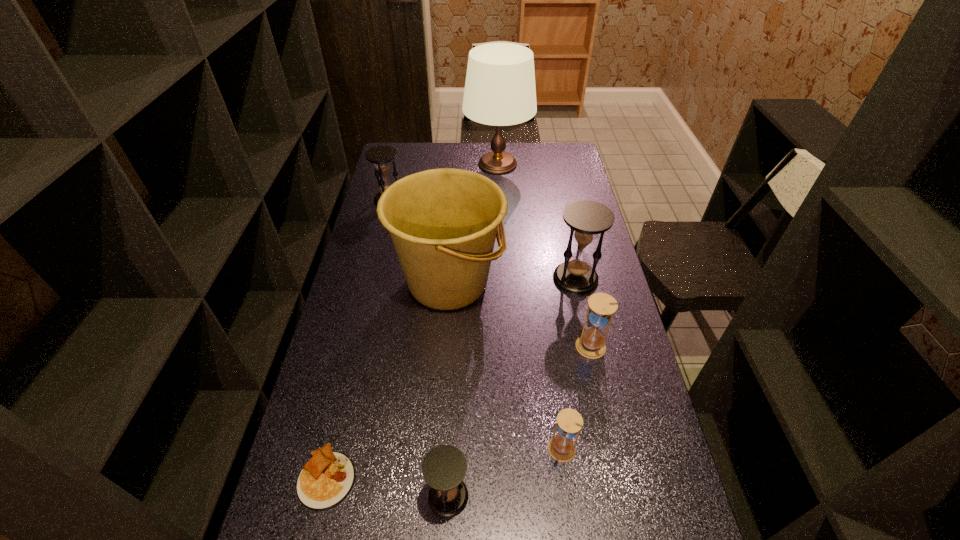
Where is `white lamp`? Image resolution: width=960 pixels, height=540 pixels. white lamp is located at coordinates (500, 90).

Where is `lamp`? The height and width of the screenshot is (540, 960). lamp is located at coordinates (500, 90).

Locate an element on the screen. The width and height of the screenshot is (960, 540). bucket is located at coordinates (443, 223).

The width and height of the screenshot is (960, 540). In order to click on the sixth shortest object in this screenshot , I will do `click(587, 219)`.

The image size is (960, 540). Identify the location of the biggest black hourglass. (587, 219).

Find the location of a particular element. The width and height of the screenshot is (960, 540). the leftmost hourglass is located at coordinates (381, 156).

This screenshot has height=540, width=960. What are the coordinates of `the second biggest black hourglass` in the screenshot? It's located at (381, 156).

This screenshot has width=960, height=540. What are the coordinates of `the bigger white hourglass` in the screenshot? It's located at (601, 307).

I want to click on the third nearest hourglass, so click(601, 307).

Find the location of a particular element. The width and height of the screenshot is (960, 540). the smallest black hourglass is located at coordinates (444, 468).